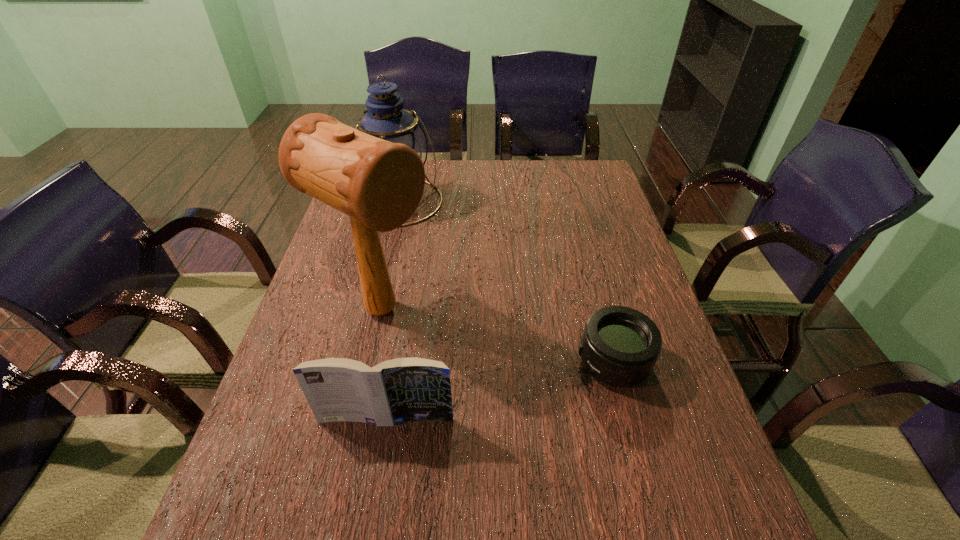
This screenshot has width=960, height=540. In order to click on vacant space on the desktop that is between the book and the shortest object and is positioned on the front-facing side of the lantern in this screenshot , I will do `click(537, 382)`.

You are a GUI agent. You are given a task and a screenshot of the screen. Output one action in this format:
    pyautogui.click(x=<x>, y=<y>)
    Task: Click on the free space on the desktop that is between the second shortest object and the shortest object and is positioned on the strike surface of the mallet
    This screenshot has height=540, width=960.
    Given the screenshot: What is the action you would take?
    pyautogui.click(x=506, y=389)